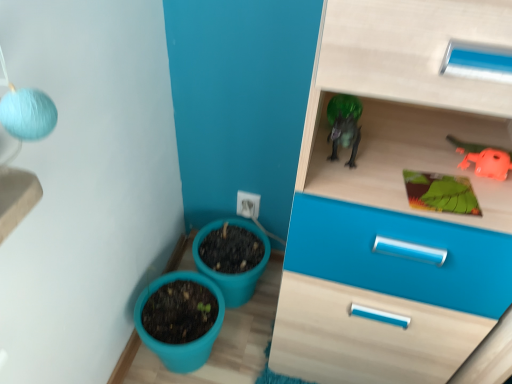
Question: Is there a large distance between orange rubber toy at upper right and matte plastic flowerpot at lower center, the second flowerpot in the front-to-back sequence?

Choices:
 (A) yes
 (B) no

Answer: (B)

Question: From the image's perspective, does orange rubber toy at upper right appear lower than matte plastic flowerpot at lower center, the second flowerpot in the front-to-back sequence?

Choices:
 (A) no
 (B) yes

Answer: (A)

Question: From a real-world perspective, is orange rubber toy at upper right below matte plastic flowerpot at lower center, the second flowerpot in the front-to-back sequence?

Choices:
 (A) no
 (B) yes

Answer: (A)

Question: Is orange rubber toy at upper right taller than matte plastic flowerpot at lower center, which appears as the 1th flowerpot when viewed from the back?

Choices:
 (A) yes
 (B) no

Answer: (B)

Question: Does orange rubber toy at upper right appear on the left side of matte plastic flowerpot at lower center, which appears as the 1th flowerpot when viewed from the back?

Choices:
 (A) no
 (B) yes

Answer: (A)

Question: Can you confirm if orange rubber toy at upper right is wider than matte plastic flowerpot at lower center, which appears as the 1th flowerpot when viewed from the back?

Choices:
 (A) no
 (B) yes

Answer: (A)

Question: Is teal plastic flowerpot at lower left, which is the first flowerpot in front-to-back order, touching orange rubber toy at upper right?

Choices:
 (A) no
 (B) yes

Answer: (A)

Question: Would you say teal plastic flowerpot at lower left, marked as the 2th flowerpot in a back-to-front arrangement, contains orange rubber toy at upper right?

Choices:
 (A) no
 (B) yes

Answer: (A)

Question: Considering the relative sizes of teal plastic flowerpot at lower left, which is the first flowerpot in front-to-back order, and orange rubber toy at upper right in the image provided, is teal plastic flowerpot at lower left, which is the first flowerpot in front-to-back order, bigger than orange rubber toy at upper right?

Choices:
 (A) no
 (B) yes

Answer: (B)

Question: Considering the relative positions of teal plastic flowerpot at lower left, marked as the 2th flowerpot in a back-to-front arrangement, and orange rubber toy at upper right in the image provided, is teal plastic flowerpot at lower left, marked as the 2th flowerpot in a back-to-front arrangement, behind orange rubber toy at upper right?

Choices:
 (A) no
 (B) yes

Answer: (B)

Question: Does teal plastic flowerpot at lower left, which is the first flowerpot in front-to-back order, have a greater height compared to orange rubber toy at upper right?

Choices:
 (A) yes
 (B) no

Answer: (A)

Question: Could you tell me if teal plastic flowerpot at lower left, marked as the 2th flowerpot in a back-to-front arrangement, is turned towards orange rubber toy at upper right?

Choices:
 (A) no
 (B) yes

Answer: (A)

Question: Would you say green matte board at upper right is a long distance from matte plastic flowerpot at lower center, the second flowerpot in the front-to-back sequence?

Choices:
 (A) no
 (B) yes

Answer: (A)